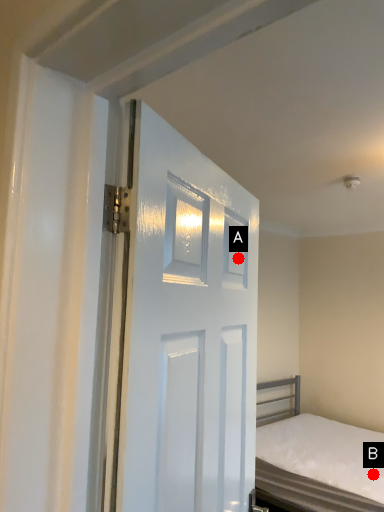
Question: Two points are circled on the image, labeled by A and B beside each circle. Which point is farther from the camera taking this photo?

Choices:
 (A) A is further
 (B) B is further

Answer: (B)